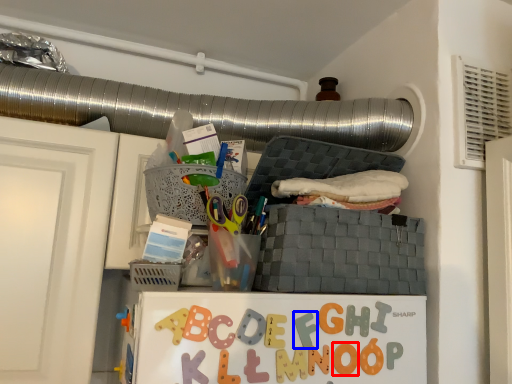
Question: Which object appears farthest to the camera in this image, letter (highlighted by a red box) or alphabet (highlighted by a blue box)?

Choices:
 (A) letter
 (B) alphabet

Answer: (A)